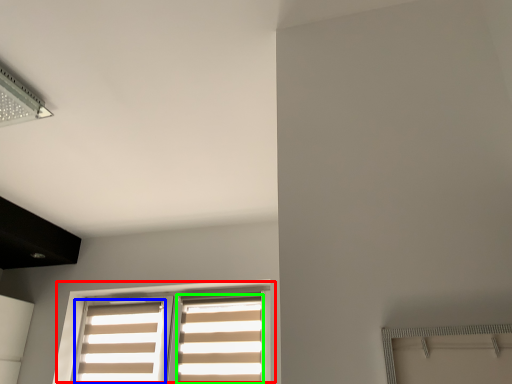
Question: Which object is the closest to the window (highlighted by a red box)? Choose among these: curtain (highlighted by a blue box) or curtain (highlighted by a green box).

Choices:
 (A) curtain
 (B) curtain

Answer: (A)